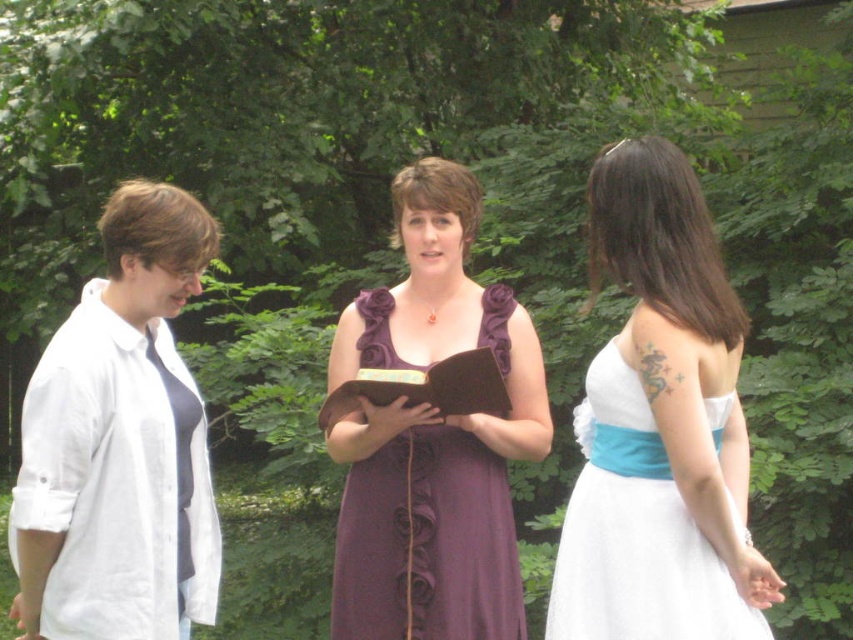
Question: Among these points, which one is farthest from the camera?

Choices:
 (A) (485, 396)
 (B) (695, 621)

Answer: (A)

Question: Observing the image, what is the correct spatial positioning of white satin dress at center in reference to matte purple book at center?

Choices:
 (A) right
 (B) left

Answer: (A)

Question: Does purple satin dress at center have a lesser width compared to black satin tie at left?

Choices:
 (A) yes
 (B) no

Answer: (B)

Question: From the image, what is the correct spatial relationship of purple satin dress at center in relation to matte purple book at center?

Choices:
 (A) above
 (B) below

Answer: (B)

Question: Estimate the real-world distances between objects in this image. Which object is closer to the matte purple book at center?

Choices:
 (A) purple satin dress at center
 (B) white cotton shirt at left
 (C) black satin tie at left
 (D) white satin dress at center

Answer: (A)

Question: Which point is farther to the camera?

Choices:
 (A) purple satin dress at center
 (B) white cotton shirt at left
 (C) black satin tie at left

Answer: (A)